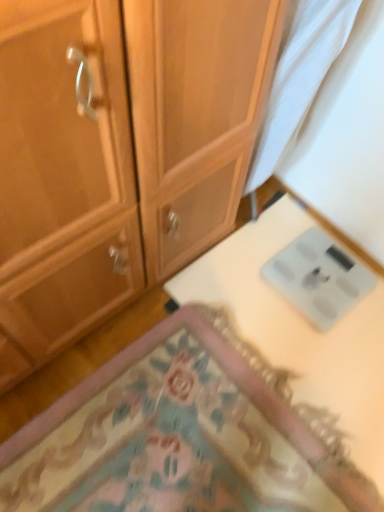
Identify the location of vacant space in white sheer curtain at upper right (from a real-world perspective). (266, 204).